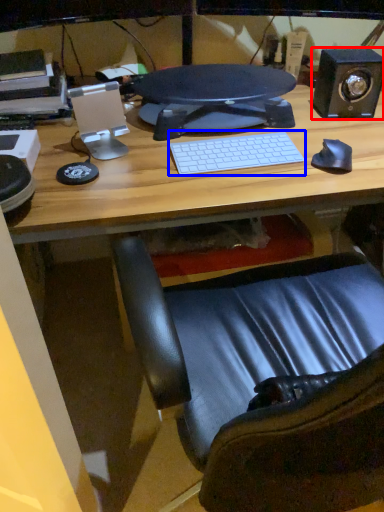
Question: Which object appears closest to the camera in this image, speaker (highlighted by a red box) or computer keyboard (highlighted by a blue box)?

Choices:
 (A) speaker
 (B) computer keyboard

Answer: (B)